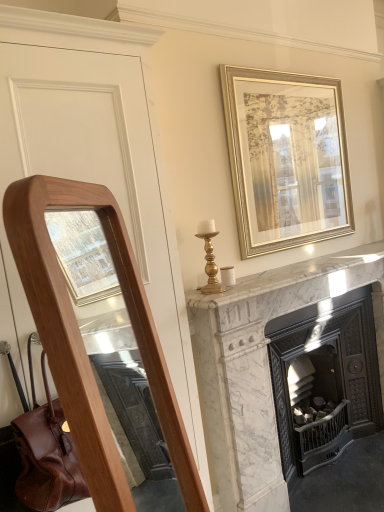
Question: From their relative heights in the image, would you say white marble fireplace at center is taller or shorter than gold metallic picture frame at upper center?

Choices:
 (A) short
 (B) tall

Answer: (B)

Question: Is white marble fireplace at center inside the boundaries of gold metallic picture frame at upper center, or outside?

Choices:
 (A) inside
 (B) outside

Answer: (B)

Question: Considering the relative positions of white marble fireplace at center and gold metallic picture frame at upper center in the image provided, is white marble fireplace at center to the left or to the right of gold metallic picture frame at upper center?

Choices:
 (A) right
 (B) left

Answer: (A)

Question: Would you say gold metallic picture frame at upper center is inside or outside white marble fireplace at center?

Choices:
 (A) inside
 (B) outside

Answer: (B)

Question: Looking at their shapes, would you say gold metallic picture frame at upper center is wider or thinner than white marble fireplace at center?

Choices:
 (A) wide
 (B) thin

Answer: (B)

Question: From a real-world perspective, is gold metallic picture frame at upper center physically located above or below white marble fireplace at center?

Choices:
 (A) above
 (B) below

Answer: (A)

Question: Looking at the image, does gold metallic picture frame at upper center seem bigger or smaller compared to white marble fireplace at center?

Choices:
 (A) small
 (B) big

Answer: (A)